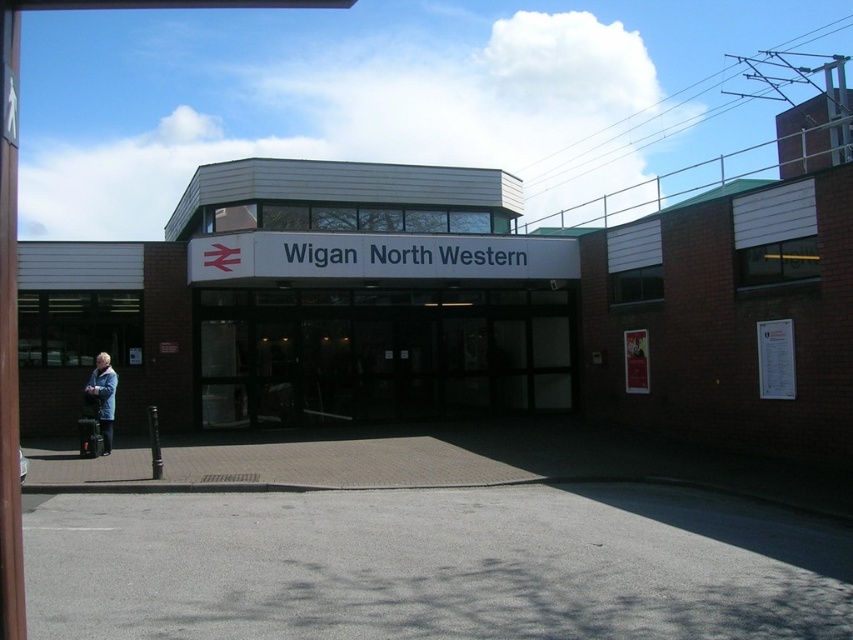
Question: Considering the relative positions of transparent glass doors at center and blue denim jacket at left in the image provided, where is transparent glass doors at center located with respect to blue denim jacket at left?

Choices:
 (A) above
 (B) below

Answer: (A)

Question: Which point is farther to the camera?

Choices:
 (A) (555, 337)
 (B) (97, 356)

Answer: (A)

Question: Can you confirm if transparent glass doors at center is positioned to the right of blue denim jacket at left?

Choices:
 (A) yes
 (B) no

Answer: (A)

Question: Which point is closer to the camera?

Choices:
 (A) (444, 394)
 (B) (106, 390)

Answer: (B)

Question: Is transparent glass doors at center positioned before blue denim jacket at left?

Choices:
 (A) yes
 (B) no

Answer: (B)